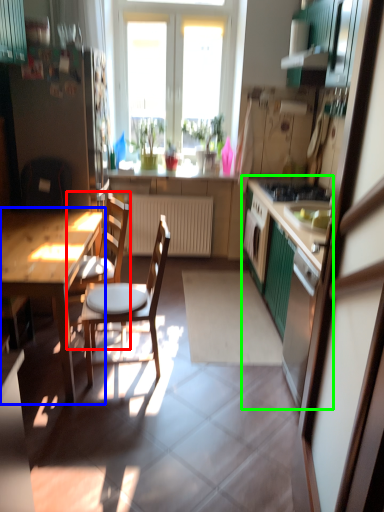
Question: Which object is positioned farthest from chair (highlighted by a red box)? Select from table (highlighted by a blue box) and cabinetry (highlighted by a green box).

Choices:
 (A) table
 (B) cabinetry

Answer: (B)